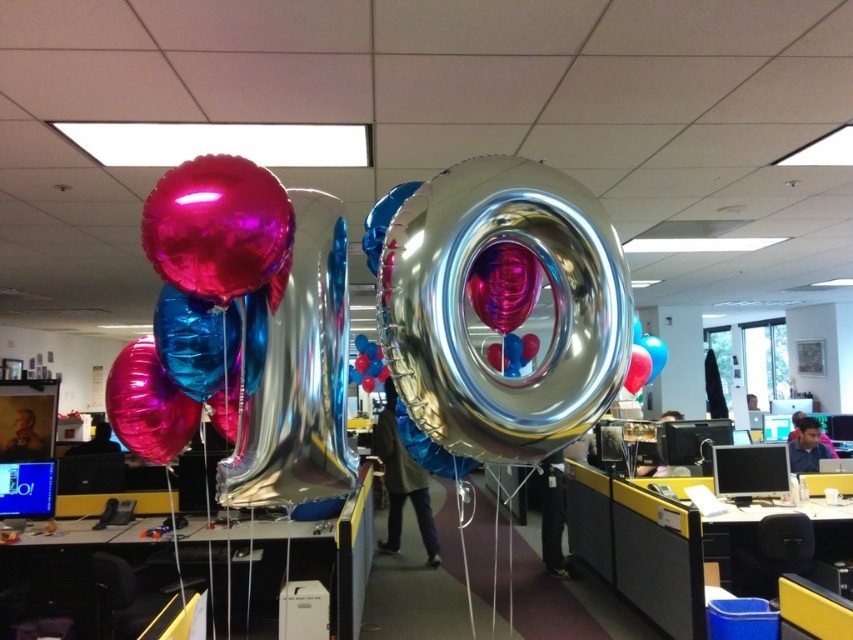
Is metallic silver balloon at center wider than silver metallic balloon at center?

Yes, metallic silver balloon at center is wider than silver metallic balloon at center.

Where is `metallic silver balloon at center`? The width and height of the screenshot is (853, 640). metallic silver balloon at center is located at coordinates [x=148, y=404].

Between point (166, 442) and point (16, 486), which one is positioned behind?

The point (16, 486) is more distant.

In order to click on metallic silver balloon at center in this screenshot , I will do `click(148, 404)`.

Is glossy metallic balloon at center thinner than metallic silver balloon at center?

Yes.

How much distance is there between glossy metallic balloon at center and metallic silver balloon at center?

The distance of glossy metallic balloon at center from metallic silver balloon at center is 13.26 inches.

Is point (193, 179) farther from camera compared to point (137, 368)?

No.

This screenshot has height=640, width=853. I want to click on glossy metallic balloon at center, so click(x=219, y=228).

Who is taller, glossy metallic balloon at center or silver metallic balloon at center?

With more height is glossy metallic balloon at center.

Who is positioned more to the right, glossy metallic balloon at center or silver metallic balloon at center?

glossy metallic balloon at center

Between point (219, 227) and point (22, 484), which one is positioned behind?

Point (22, 484)

Identify the location of glossy metallic balloon at center. (219, 228).